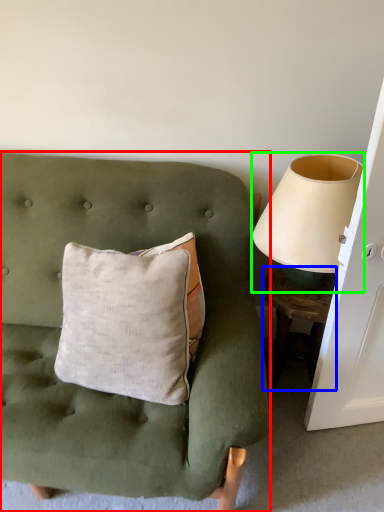
Question: Which object is the closest to the furniture (highlighted by a red box)? Choose among these: table (highlighted by a blue box) or table lamp (highlighted by a green box).

Choices:
 (A) table
 (B) table lamp

Answer: (B)